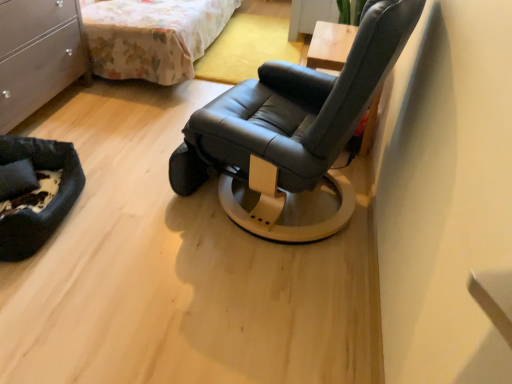
Find the location of a particular element. This screenshot has width=512, height=384. vacant space that's between black leather chair at center and black fabric pet bed at lower left is located at coordinates [x=145, y=216].